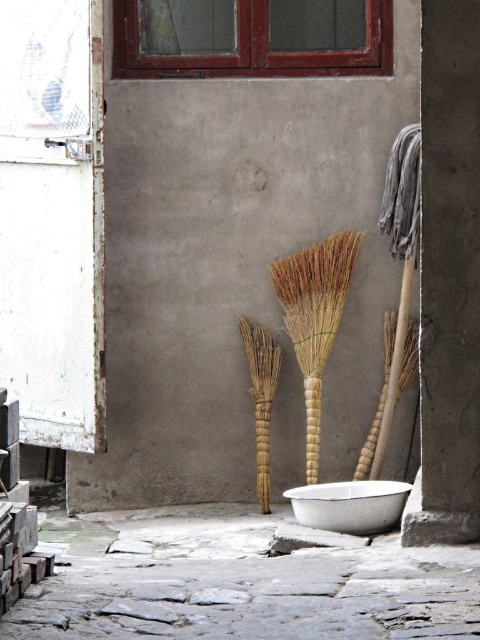
Is point (386, 509) positioned before point (271, 406)?

Yes.

The width and height of the screenshot is (480, 640). What do you see at coordinates (349, 506) in the screenshot?
I see `white enamel bowl at lower center` at bounding box center [349, 506].

Where is `white enamel bowl at lower center`? Image resolution: width=480 pixels, height=640 pixels. white enamel bowl at lower center is located at coordinates (349, 506).

Can you confirm if natural straw broom at center is thinner than brown straw broom at center?

In fact, natural straw broom at center might be wider than brown straw broom at center.

Describe the element at coordinates (314, 317) in the screenshot. This screenshot has height=640, width=480. I see `natural straw broom at center` at that location.

At what (x,y) coordinates should I click in order to perform the action: click on natural straw broom at center. Please return your answer as a coordinate pair (x, y). The height and width of the screenshot is (640, 480). Looking at the image, I should click on (314, 317).

At what (x,y) coordinates should I click in order to perform the action: click on natural straw broom at center. Please return your answer as a coordinate pair (x, y). The width and height of the screenshot is (480, 640). Looking at the image, I should click on coord(314,317).

Describe the element at coordinates (314, 317) in the screenshot. I see `natural straw broom at center` at that location.

Is point (317, 372) in front of point (377, 497)?

That is False.

Locate an element on the screen. This screenshot has width=480, height=640. natural straw broom at center is located at coordinates (314, 317).